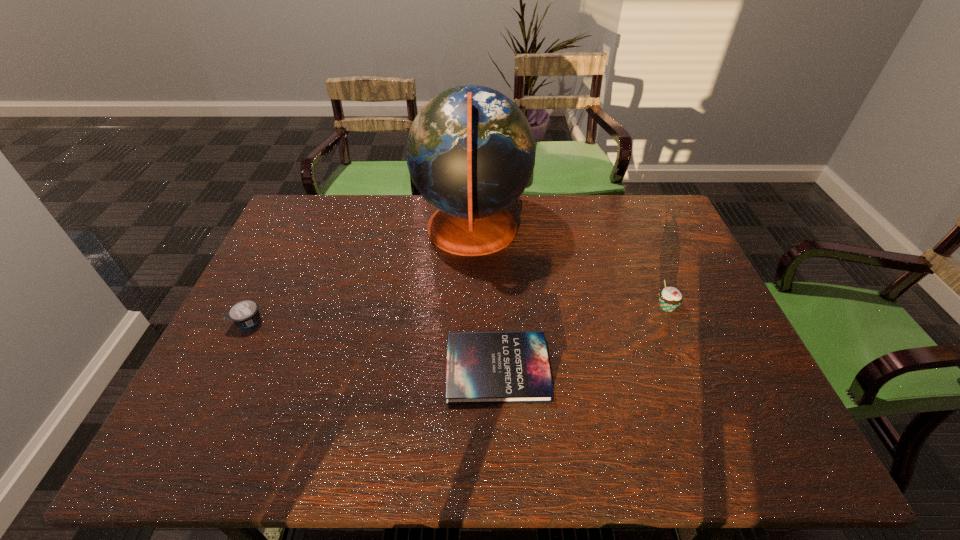
Find the location of a particular element. This screenshot has height=540, width=960. blank region between the globe and the hardback book is located at coordinates (485, 299).

Locate an element on the screen. This screenshot has height=540, width=960. free space between the third tallest object and the globe is located at coordinates (360, 275).

Find the location of a particular element. free space between the nearest object and the third tallest object is located at coordinates (372, 345).

At what (x,y) coordinates should I click in order to perform the action: click on empty space that is in between the globe and the yogurt. Please return your answer as a coordinate pair (x, y). Looking at the image, I should click on (360, 275).

Image resolution: width=960 pixels, height=540 pixels. In order to click on empty space that is in between the third shortest object and the yogurt in this screenshot , I will do `click(458, 314)`.

Locate an element on the screen. The image size is (960, 540). free space between the farthest object and the nearest object is located at coordinates (485, 299).

Locate an element on the screen. unoccupied area between the leftmost object and the shortest object is located at coordinates (372, 345).

What are the coordinates of `unoccupied position between the cupcake and the nearest object` in the screenshot? It's located at (582, 338).

Locate an element on the screen. The height and width of the screenshot is (540, 960). unoccupied area between the third tallest object and the cupcake is located at coordinates (458, 314).

Identify which object is located as the third nearest to the nearest object. Please provide its 2D coordinates. Your answer should be formatted as a tuple, i.e. [(x, y)], where the tuple contains the x and y coordinates of a point satisfying the conditions above.

[(245, 313)]